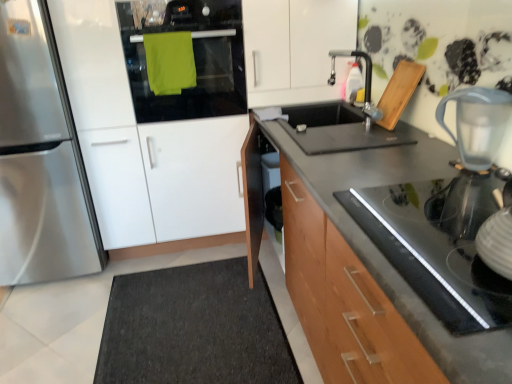
Find the location of `free space on the front side of satin silver refrigerator at left`. free space on the front side of satin silver refrigerator at left is located at coordinates (45, 304).